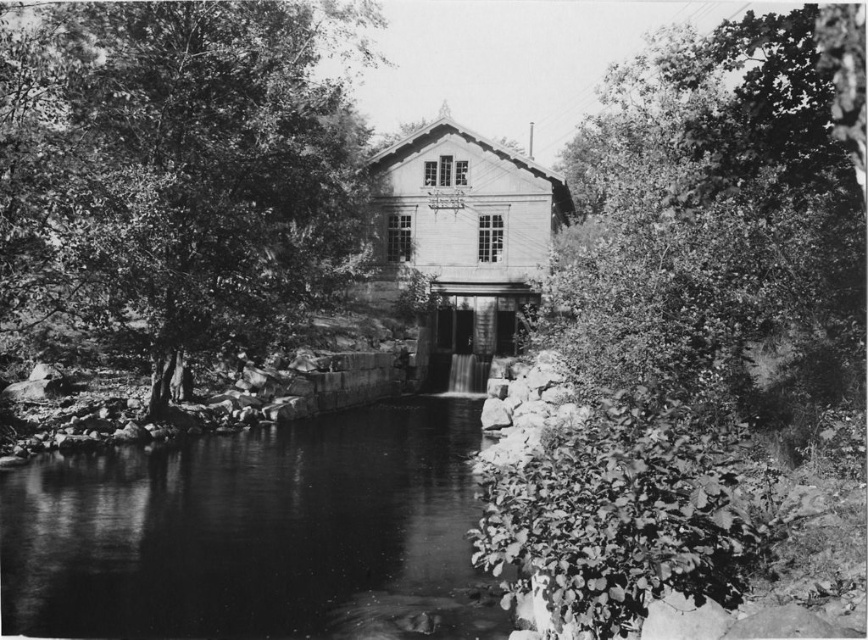
Measure the distance between smooth stone river at center and thick green foliage at right.

smooth stone river at center is 17.37 meters from thick green foliage at right.

Is smooth stone river at center smaller than thick green foliage at right?

Yes, smooth stone river at center is smaller than thick green foliage at right.

What are the coordinates of `smooth stone river at center` in the screenshot? It's located at (255, 532).

What do you see at coordinates (178, 168) in the screenshot? Image resolution: width=868 pixels, height=640 pixels. I see `smooth bark tree at center` at bounding box center [178, 168].

Who is more forward, (62,224) or (163,547)?

Point (163,547) is more forward.

Image resolution: width=868 pixels, height=640 pixels. What are the coordinates of `smooth bark tree at center` in the screenshot? It's located at (178, 168).

This screenshot has height=640, width=868. Find the location of `smooth bark tree at center`. smooth bark tree at center is located at coordinates (178, 168).

Is point (196, 292) more distant than point (592, 154)?

No.

Locate an element on the screen. smooth bark tree at center is located at coordinates (178, 168).